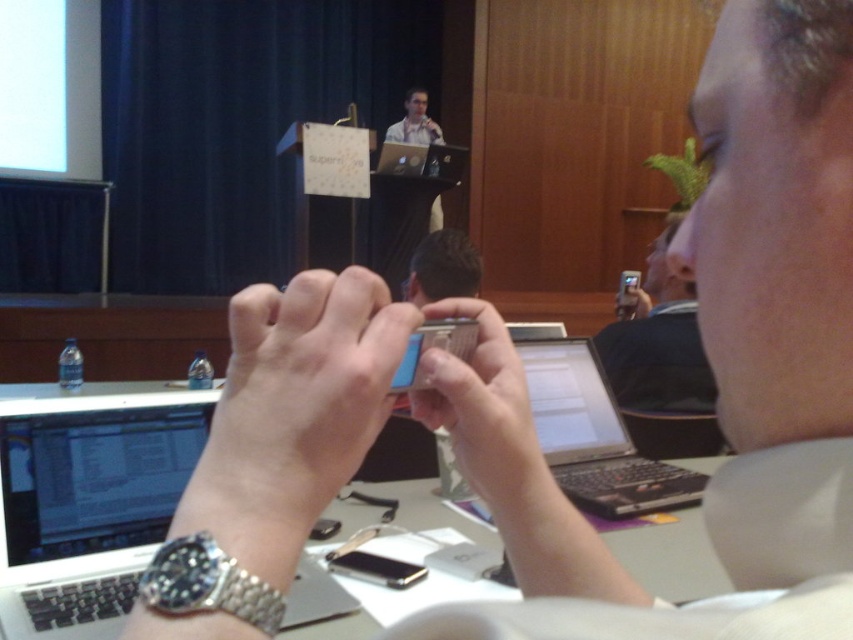
Question: From the image, what is the correct spatial relationship of white plastic table at center in relation to silver metallic watch at center?

Choices:
 (A) right
 (B) left

Answer: (B)

Question: Which object is closer to the camera taking this photo?

Choices:
 (A) black plastic laptop at center
 (B) silver metallic watch at lower left
 (C) metallic silver phone at center
 (D) white matte laptop at lower left

Answer: (B)

Question: Which point is farther from the camera taking this photo?

Choices:
 (A) pos(345,307)
 (B) pos(485,342)
 (C) pos(106,532)

Answer: (C)

Question: Does white plastic table at center appear over silver metallic watch at center?

Choices:
 (A) no
 (B) yes

Answer: (A)

Question: Which point is closer to the camera?

Choices:
 (A) white plastic table at center
 (B) silver metallic watch at lower left
 (C) black plastic laptop at center
 (D) white matte laptop at lower left

Answer: (B)

Question: From the image, what is the correct spatial relationship of black plastic laptop at center in relation to metallic silver phone at center?

Choices:
 (A) below
 (B) above

Answer: (A)